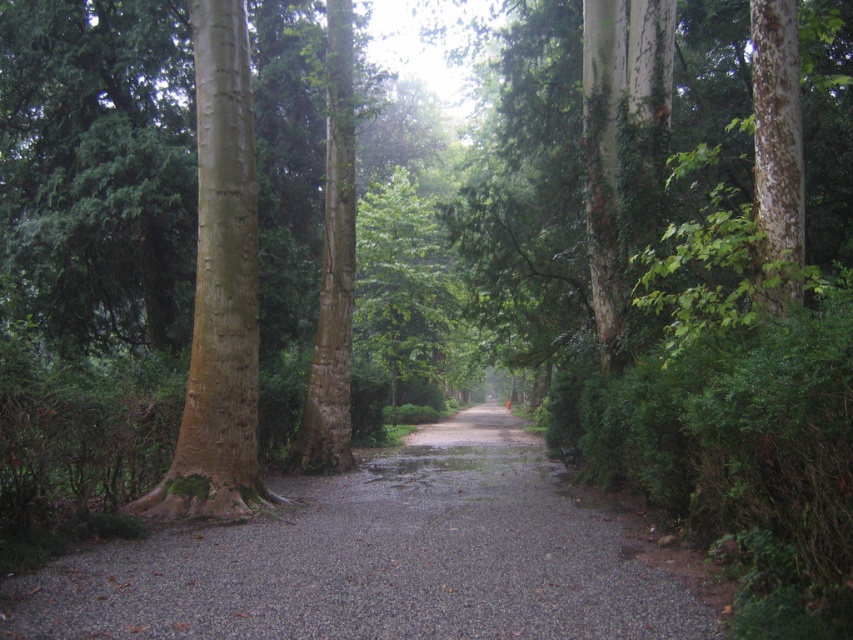
Can you confirm if gray gravel alley at center is positioned to the right of brown rough bark tree at left?

Yes, gray gravel alley at center is to the right of brown rough bark tree at left.

Can you confirm if gray gravel alley at center is smaller than brown rough bark tree at left?

No.

Find the location of `gray gravel alley at center`. gray gravel alley at center is located at coordinates (384, 560).

Identify the location of gray gravel alley at center. (384, 560).